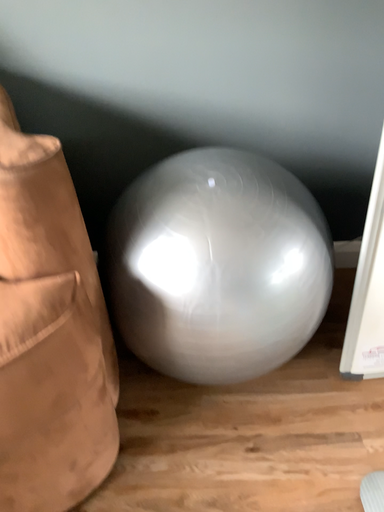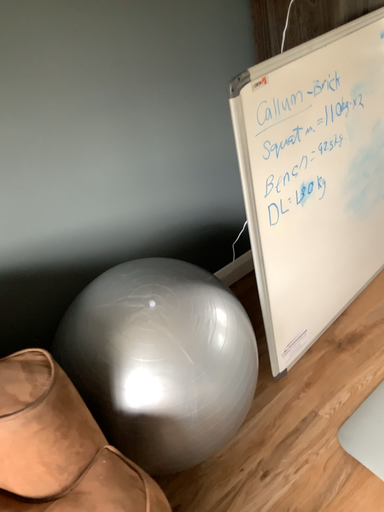
Question: How did the camera likely rotate when shooting the video?

Choices:
 (A) rotated left
 (B) rotated right

Answer: (B)